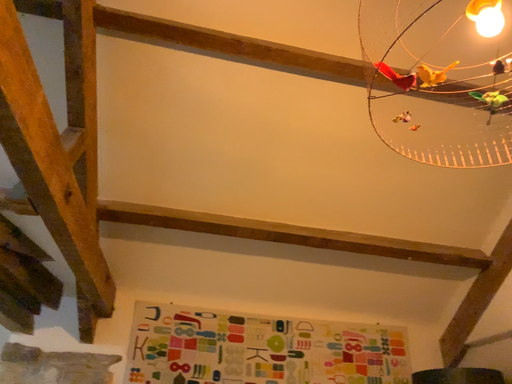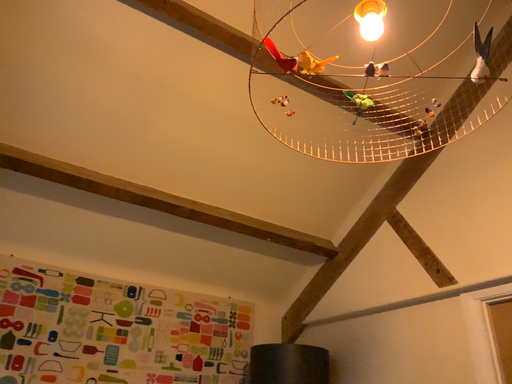
Question: How did the camera likely rotate when shooting the video?

Choices:
 (A) rotated right
 (B) rotated left

Answer: (A)